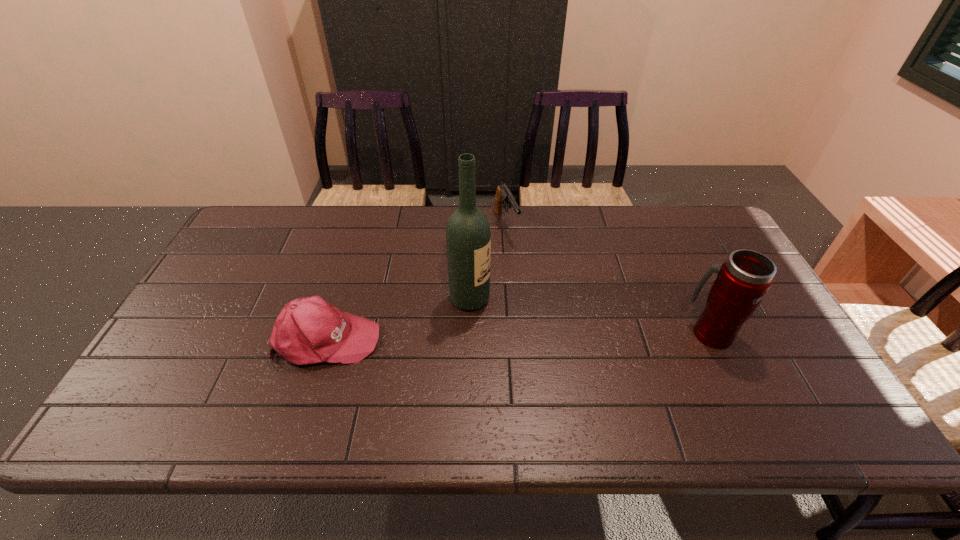
You are a GUI agent. You are given a task and a screenshot of the screen. Output one action in this format:
    pyautogui.click(x=<x>, y=<y>)
    Task: Click on the leftmost object
    The image size is (960, 540).
    Given the screenshot: What is the action you would take?
    pyautogui.click(x=309, y=330)

You are a GUI agent. You are given a task and a screenshot of the screen. Output one action in this format:
    pyautogui.click(x=<x>, y=<y>)
    Task: Click on the second tallest object
    
    Given the screenshot: What is the action you would take?
    pyautogui.click(x=744, y=278)

Locate an element on the screen. thermos bottle is located at coordinates (744, 278).

Find the location of a particular element. This screenshot has width=960, height=540. the tallest object is located at coordinates (468, 237).

Locate an element on the screen. The width and height of the screenshot is (960, 540). wine bottle is located at coordinates (468, 237).

Where is `the third object from left to right`? Image resolution: width=960 pixels, height=540 pixels. the third object from left to right is located at coordinates (503, 195).

Where is `the farthest object`? The height and width of the screenshot is (540, 960). the farthest object is located at coordinates (503, 195).

Where is `vacant space located 0.260m at the front of the baseball cap with the brim`? The width and height of the screenshot is (960, 540). vacant space located 0.260m at the front of the baseball cap with the brim is located at coordinates (482, 339).

Identify the location of vacant space located on the side with the handle of the thermos bottle. The height and width of the screenshot is (540, 960). (656, 333).

Where is `vacant space located on the side with the handle of the thermos bottle`? This screenshot has height=540, width=960. vacant space located on the side with the handle of the thermos bottle is located at coordinates (633, 333).